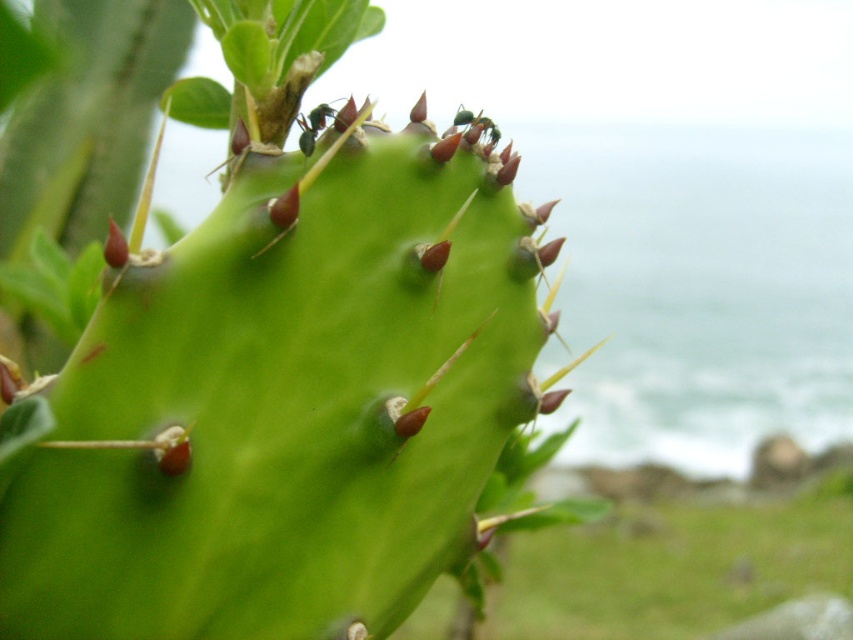
What do you see at coordinates (283, 371) in the screenshot?
I see `green spiny cactus at center` at bounding box center [283, 371].

Does green spiny cactus at center have a greater height compared to black glossy ant at upper center?

Correct, green spiny cactus at center is much taller as black glossy ant at upper center.

Describe the element at coordinates (283, 371) in the screenshot. I see `green spiny cactus at center` at that location.

Identify the location of green spiny cactus at center. (283, 371).